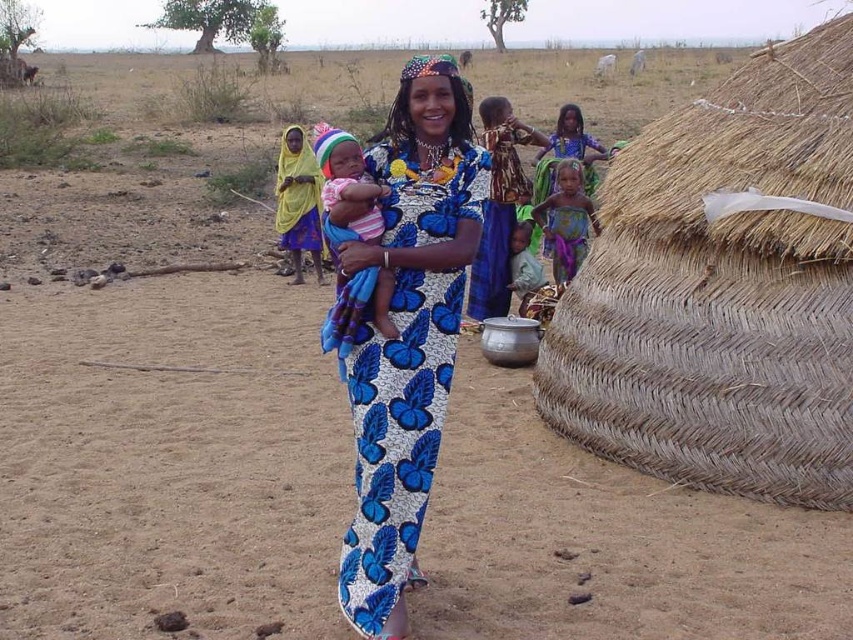
Question: Is purple fabric dress at center below light green fabric at lower center?

Choices:
 (A) no
 (B) yes

Answer: (A)

Question: Does blue printed dress at center appear on the left side of striped fabric baby at center?

Choices:
 (A) no
 (B) yes

Answer: (A)

Question: Which point appears farthest from the camera in this image?

Choices:
 (A) (521, 296)
 (B) (563, 236)

Answer: (A)

Question: Among these points, which one is nearest to the camera?

Choices:
 (A) (520, 260)
 (B) (383, 307)

Answer: (B)

Question: Is striped fabric baby at center wider than light green fabric at lower center?

Choices:
 (A) no
 (B) yes

Answer: (A)

Question: Among these objects, which one is nearest to the camera?

Choices:
 (A) light green fabric at lower center
 (B) blue printed dress at center
 (C) striped fabric baby at center
 (D) purple fabric dress at center

Answer: (B)